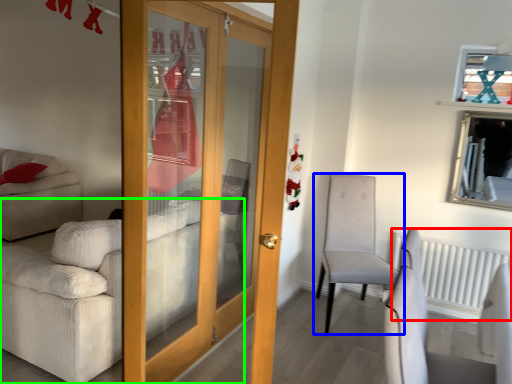
Question: Which is nearer to the radiator (highlighted by a red box)? chair (highlighted by a blue box) or studio couch (highlighted by a green box).

Choices:
 (A) chair
 (B) studio couch

Answer: (A)